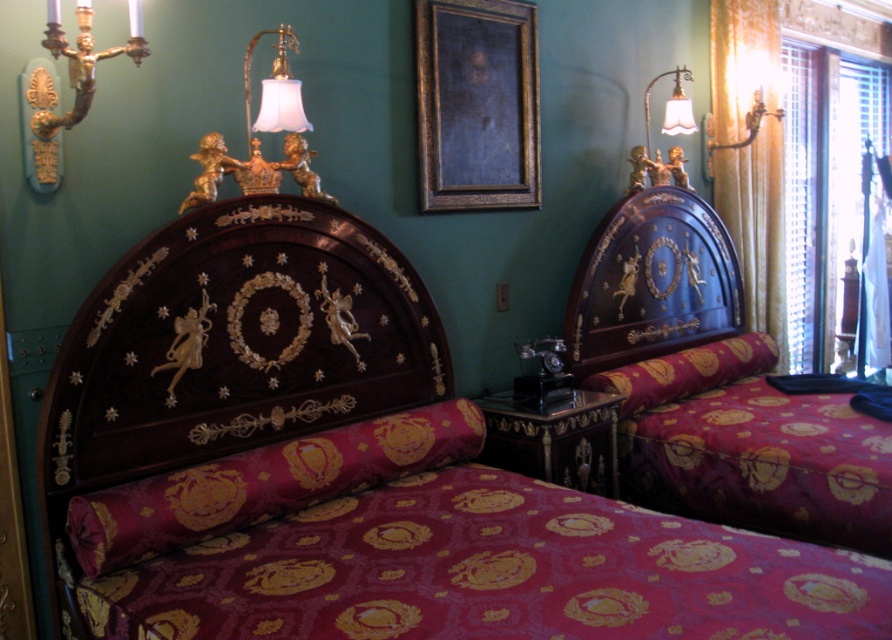
How much distance is there between polished dark wood bed at left and matte dark wood bed at right?

polished dark wood bed at left and matte dark wood bed at right are 1.05 meters apart from each other.

The image size is (892, 640). What do you see at coordinates (356, 468) in the screenshot?
I see `polished dark wood bed at left` at bounding box center [356, 468].

The height and width of the screenshot is (640, 892). I want to click on polished dark wood bed at left, so click(356, 468).

Find the location of a particular element. polished dark wood bed at left is located at coordinates (356, 468).

Does gold-bronze sconce at upper left appear on the right side of white fabric lampshade at upper right?

Incorrect, gold-bronze sconce at upper left is not on the right side of white fabric lampshade at upper right.

Where is `gold-bronze sconce at upper left`? The image size is (892, 640). gold-bronze sconce at upper left is located at coordinates (70, 86).

Locate an element on the screen. This screenshot has width=892, height=640. gold-bronze sconce at upper left is located at coordinates (70, 86).

Does yellow sheer curtain at right appear on the left side of gold-bronze sconce at upper left?

No, yellow sheer curtain at right is not to the left of gold-bronze sconce at upper left.

Is yellow sheer curtain at right smaller than gold-bronze sconce at upper left?

No, yellow sheer curtain at right is not smaller than gold-bronze sconce at upper left.

Is point (724, 104) more distant than point (46, 106)?

Yes, point (724, 104) is behind point (46, 106).

Find the location of `yellow sheer curtain at right`. yellow sheer curtain at right is located at coordinates (756, 227).